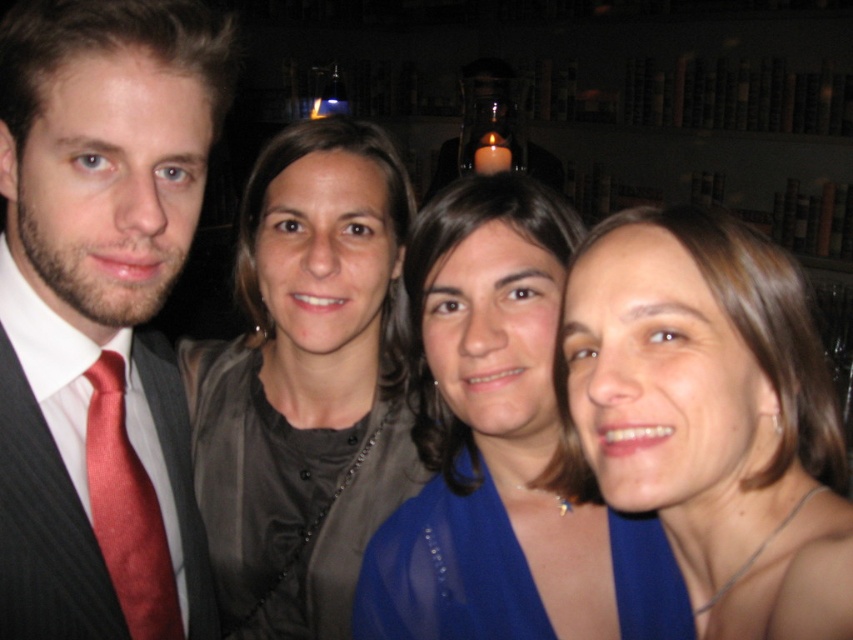
Question: Which object is the farthest from the matte blue dress at center?

Choices:
 (A) shiny red tie at left
 (B) matte red tie at left

Answer: (A)

Question: Where is blue sheer blouse at center located in relation to blue sheer dress at lower right in the image?

Choices:
 (A) below
 (B) above

Answer: (B)

Question: Which object appears farthest from the camera in this image?

Choices:
 (A) blue sheer dress at lower right
 (B) matte blue dress at center
 (C) shiny red tie at left

Answer: (C)

Question: Which of the following is the farthest from the observer?

Choices:
 (A) shiny red tie at left
 (B) blue sheer blouse at center

Answer: (A)

Question: In this image, where is matte gray blouse at center located relative to blue sheer dress at lower right?

Choices:
 (A) above
 (B) below

Answer: (A)

Question: Where is matte gray blouse at center located in relation to blue sheer blouse at center in the image?

Choices:
 (A) left
 (B) right

Answer: (A)